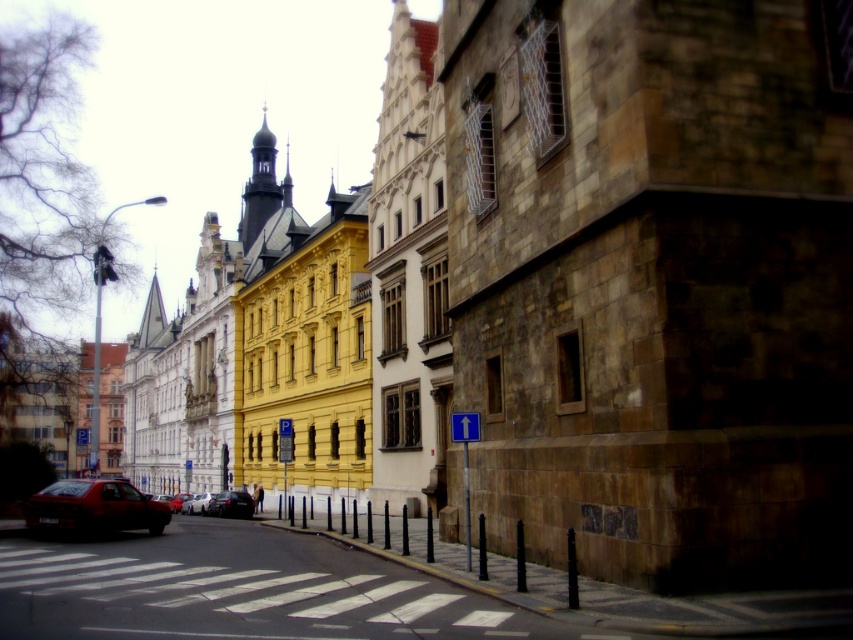
Question: Considering the real-world distances, which object is closest to the blue plastic sign at upper center?

Choices:
 (A) shiny red car at center
 (B) shiny red sedan at lower left
 (C) metallic silver car at center
 (D) shiny black car at center

Answer: (B)

Question: Based on their relative distances, which object is farther from the metallic silver car at center?

Choices:
 (A) shiny red sedan at lower left
 (B) shiny red car at center
 (C) shiny black car at center

Answer: (A)

Question: Is shiny black car at center to the right of blue plastic sign at upper center from the viewer's perspective?

Choices:
 (A) yes
 (B) no

Answer: (B)

Question: Can you confirm if shiny red sedan at lower left is wider than blue plastic sign at upper center?

Choices:
 (A) yes
 (B) no

Answer: (A)

Question: Does shiny black car at center have a larger size compared to blue plastic sign at upper center?

Choices:
 (A) yes
 (B) no

Answer: (A)

Question: Estimate the real-world distances between objects in this image. Which object is closer to the blue plastic sign at upper center?

Choices:
 (A) shiny red sedan at lower left
 (B) shiny red car at center
 (C) shiny black car at center
 (D) metallic silver car at center

Answer: (A)